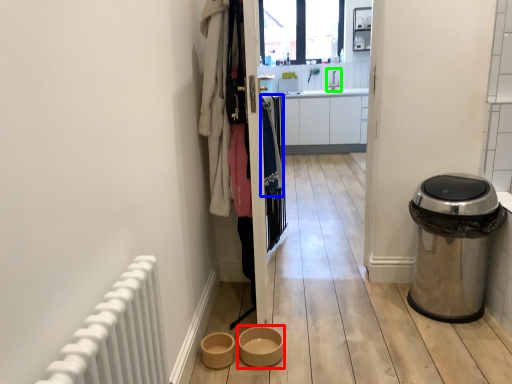
Question: Considering the real-world distances, which object is closest to toilet bowl (highlighted by a red box)? clothing (highlighted by a blue box) or sink (highlighted by a green box).

Choices:
 (A) clothing
 (B) sink

Answer: (A)